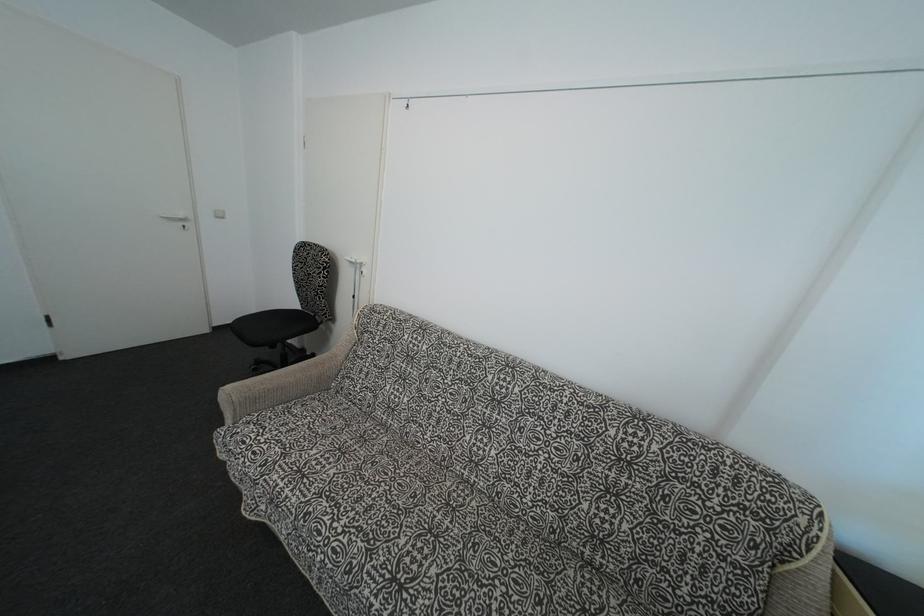
The width and height of the screenshot is (924, 616). What do you see at coordinates (272, 323) in the screenshot?
I see `the black chair sitting surface` at bounding box center [272, 323].